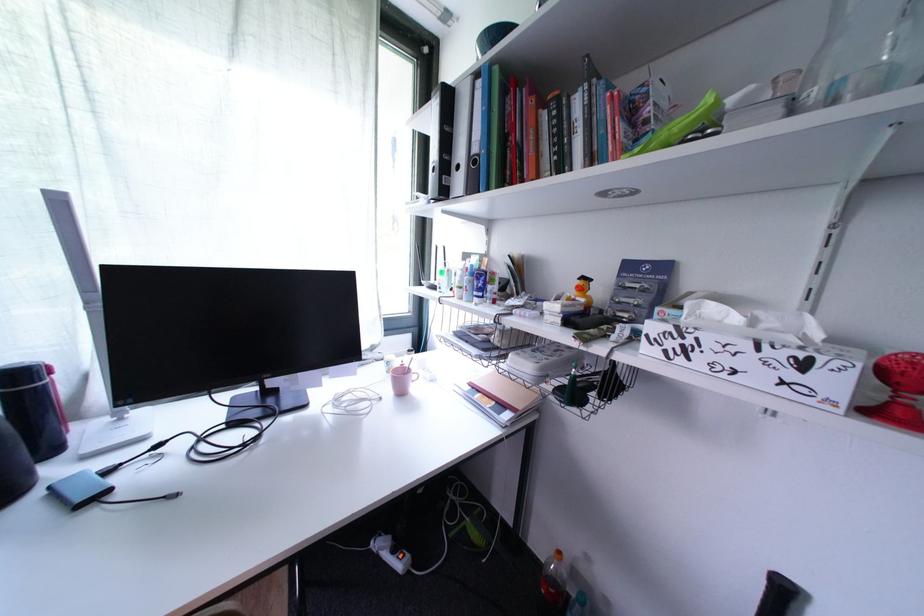
What do you see at coordinates (79, 488) in the screenshot? This screenshot has width=924, height=616. I see `the black binder spine hole` at bounding box center [79, 488].